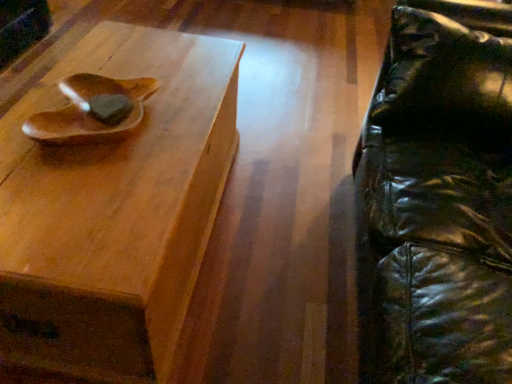
Identify the location of free point to the right of wooden bowl at upper left. The width and height of the screenshot is (512, 384). (179, 130).